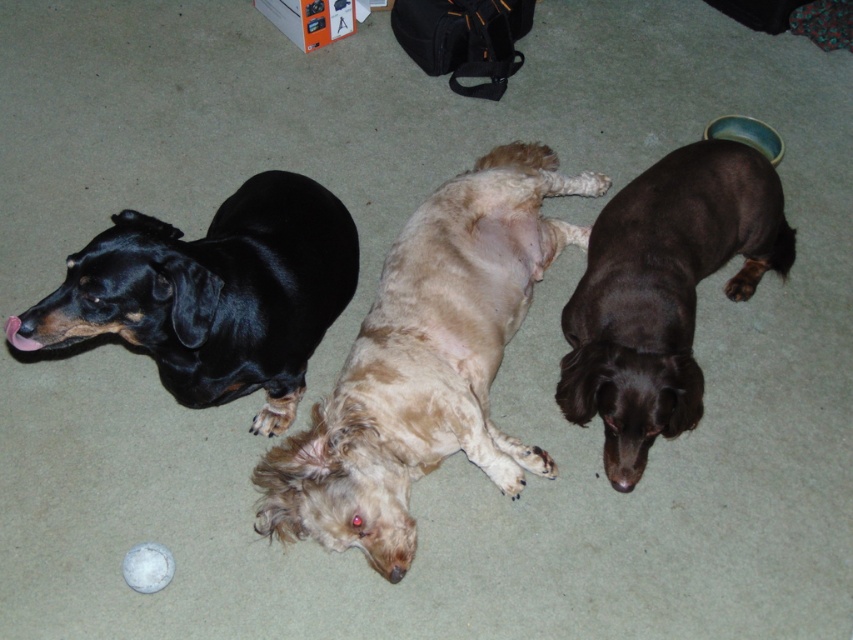
Can you confirm if light brown fur at center is positioned to the left of shiny black dachshund at left?

Incorrect, light brown fur at center is not on the left side of shiny black dachshund at left.

Which of these two, light brown fur at center or shiny black dachshund at left, stands shorter?

With less height is shiny black dachshund at left.

Is point (490, 355) in front of point (265, 278)?

No, (490, 355) is further to viewer.

Locate an element on the screen. light brown fur at center is located at coordinates (426, 362).

How distant is shiny black dog at right from white matte ball at lower center?

The distance of shiny black dog at right from white matte ball at lower center is 3.30 feet.

Locate an element on the screen. shiny black dog at right is located at coordinates (663, 292).

Is shiny black dachshund at left positioned at the back of white matte ball at lower center?

No, shiny black dachshund at left is in front of white matte ball at lower center.

Is shiny black dachshund at left below white matte ball at lower center?

No, shiny black dachshund at left is not below white matte ball at lower center.

Is point (164, 316) positioned behind point (126, 570)?

That is False.

Find the location of `shiny black dachshund at left`. shiny black dachshund at left is located at coordinates (213, 294).